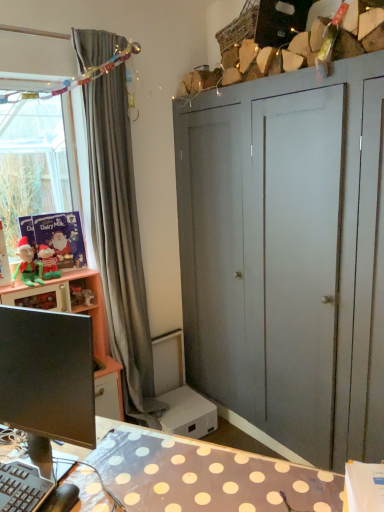
Question: Is black glossy monitor at lower left further to camera compared to gray fabric curtain at left?

Choices:
 (A) yes
 (B) no

Answer: (B)

Question: Could you tell me if black glossy monitor at lower left is turned towards gray fabric curtain at left?

Choices:
 (A) no
 (B) yes

Answer: (A)

Question: From the image's perspective, is black glossy monitor at lower left located beneath gray fabric curtain at left?

Choices:
 (A) no
 (B) yes

Answer: (B)

Question: Does black glossy monitor at lower left appear on the left side of gray fabric curtain at left?

Choices:
 (A) no
 (B) yes

Answer: (B)

Question: Is black glossy monitor at lower left positioned with its back to gray fabric curtain at left?

Choices:
 (A) no
 (B) yes

Answer: (B)

Question: In terms of height, does green plush elf at left look taller or shorter compared to black glossy monitor at lower left?

Choices:
 (A) tall
 (B) short

Answer: (B)

Question: From the image's perspective, is green plush elf at left located above or below black glossy monitor at lower left?

Choices:
 (A) above
 (B) below

Answer: (A)

Question: Is green plush elf at left in front of or behind black glossy monitor at lower left in the image?

Choices:
 (A) behind
 (B) front

Answer: (A)

Question: Visually, is green plush elf at left positioned to the left or to the right of black glossy monitor at lower left?

Choices:
 (A) right
 (B) left

Answer: (B)

Question: Considering the positions of matte gray wardrobe at upper right and green plush elf at left in the image, is matte gray wardrobe at upper right bigger or smaller than green plush elf at left?

Choices:
 (A) big
 (B) small

Answer: (A)

Question: From a real-world perspective, is matte gray wardrobe at upper right above or below green plush elf at left?

Choices:
 (A) above
 (B) below

Answer: (B)

Question: Is matte gray wardrobe at upper right taller or shorter than green plush elf at left?

Choices:
 (A) tall
 (B) short

Answer: (A)

Question: Relative to green plush elf at left, is matte gray wardrobe at upper right in front or behind?

Choices:
 (A) front
 (B) behind

Answer: (A)

Question: Is point (382, 308) closer or farther from the camera than point (74, 346)?

Choices:
 (A) closer
 (B) farther

Answer: (B)

Question: In the image, is matte gray wardrobe at upper right on the left side or the right side of black glossy monitor at lower left?

Choices:
 (A) right
 (B) left

Answer: (A)